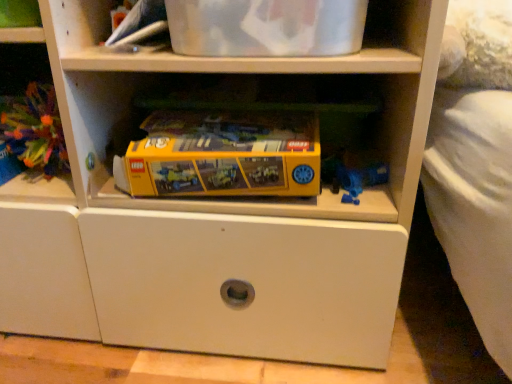
Where is `multicolored plastic toy at left, placed as the 1th toy when sorted from left to right`? The height and width of the screenshot is (384, 512). multicolored plastic toy at left, placed as the 1th toy when sorted from left to right is located at coordinates (35, 130).

What do you see at coordinates (35, 130) in the screenshot? I see `multicolored plastic toy at left, placed as the 1th toy when sorted from left to right` at bounding box center [35, 130].

In order to click on yellow plastic lego set at center, the 1th toy when ordered from right to left in this screenshot , I will do `click(222, 155)`.

Measure the distance between yellow plastic lego set at center, which appears as the 2th toy when viewed from the left, and camera.

yellow plastic lego set at center, which appears as the 2th toy when viewed from the left, and camera are 21.24 inches apart from each other.

What do you see at coordinates (222, 155) in the screenshot? The height and width of the screenshot is (384, 512). I see `yellow plastic lego set at center, which appears as the 2th toy when viewed from the left` at bounding box center [222, 155].

Identify the location of multicolored plastic toy at left, placed as the 1th toy when sorted from left to right. The height and width of the screenshot is (384, 512). (35, 130).

Is yellow plastic lego set at center, which appears as the 2th toy when viewed from the left, to the left of multicolored plastic toy at left, placed as the 1th toy when sorted from left to right, from the viewer's perspective?

No, yellow plastic lego set at center, which appears as the 2th toy when viewed from the left, is not to the left of multicolored plastic toy at left, placed as the 1th toy when sorted from left to right.

Does yellow plastic lego set at center, the 1th toy when ordered from right to left, come behind multicolored plastic toy at left, which is the second toy in right-to-left order?

That is False.

Is point (278, 176) positioned in front of point (69, 168)?

Yes, it is.

From the image's perspective, is yellow plastic lego set at center, the 1th toy when ordered from right to left, above multicolored plastic toy at left, placed as the 1th toy when sorted from left to right?

No.

From a real-world perspective, who is located lower, yellow plastic lego set at center, which appears as the 2th toy when viewed from the left, or multicolored plastic toy at left, placed as the 1th toy when sorted from left to right?

yellow plastic lego set at center, which appears as the 2th toy when viewed from the left, from a real-world perspective.

Does yellow plastic lego set at center, which appears as the 2th toy when viewed from the left, have a lesser width compared to multicolored plastic toy at left, placed as the 1th toy when sorted from left to right?

No.

Does yellow plastic lego set at center, which appears as the 2th toy when viewed from the left, have a lesser height compared to multicolored plastic toy at left, which is the second toy in right-to-left order?

Indeed, yellow plastic lego set at center, which appears as the 2th toy when viewed from the left, has a lesser height compared to multicolored plastic toy at left, which is the second toy in right-to-left order.

Considering the relative sizes of yellow plastic lego set at center, which appears as the 2th toy when viewed from the left, and multicolored plastic toy at left, placed as the 1th toy when sorted from left to right, in the image provided, is yellow plastic lego set at center, which appears as the 2th toy when viewed from the left, bigger than multicolored plastic toy at left, placed as the 1th toy when sorted from left to right,?

Yes.

Is yellow plastic lego set at center, which appears as the 2th toy when viewed from the left, positioned beyond the bounds of multicolored plastic toy at left, placed as the 1th toy when sorted from left to right?

Yes, yellow plastic lego set at center, which appears as the 2th toy when viewed from the left, is outside of multicolored plastic toy at left, placed as the 1th toy when sorted from left to right.

Is the surface of yellow plastic lego set at center, the 1th toy when ordered from right to left, in direct contact with multicolored plastic toy at left, which is the second toy in right-to-left order?

No, yellow plastic lego set at center, the 1th toy when ordered from right to left, is not touching multicolored plastic toy at left, which is the second toy in right-to-left order.

Is yellow plastic lego set at center, the 1th toy when ordered from right to left, positioned with its back to multicolored plastic toy at left, which is the second toy in right-to-left order?

No, yellow plastic lego set at center, the 1th toy when ordered from right to left, is not facing the opposite direction of multicolored plastic toy at left, which is the second toy in right-to-left order.

How many degrees apart are the facing directions of yellow plastic lego set at center, the 1th toy when ordered from right to left, and multicolored plastic toy at left, which is the second toy in right-to-left order?

They differ by 1.52 degrees in their facing directions.

The height and width of the screenshot is (384, 512). In order to click on toy above the yellow plastic lego set at center, which appears as the 2th toy when viewed from the left (from the image's perspective) in this screenshot , I will do `click(35, 130)`.

Is multicolored plastic toy at left, which is the second toy in right-to-left order, to the left of yellow plastic lego set at center, the 1th toy when ordered from right to left, from the viewer's perspective?

Indeed, multicolored plastic toy at left, which is the second toy in right-to-left order, is positioned on the left side of yellow plastic lego set at center, the 1th toy when ordered from right to left.

Which object is closer to the camera taking this photo, multicolored plastic toy at left, placed as the 1th toy when sorted from left to right, or yellow plastic lego set at center, the 1th toy when ordered from right to left?

yellow plastic lego set at center, the 1th toy when ordered from right to left, is in front.

Is point (42, 139) closer or farther from the camera than point (137, 144)?

Point (42, 139) appears to be farther away from the viewer than point (137, 144).

From the image's perspective, is multicolored plastic toy at left, placed as the 1th toy when sorted from left to right, on yellow plastic lego set at center, which appears as the 2th toy when viewed from the left?

Yes.

From a real-world perspective, is multicolored plastic toy at left, which is the second toy in right-to-left order, over yellow plastic lego set at center, which appears as the 2th toy when viewed from the left?

Yes.

Considering the relative sizes of multicolored plastic toy at left, placed as the 1th toy when sorted from left to right, and yellow plastic lego set at center, the 1th toy when ordered from right to left, in the image provided, is multicolored plastic toy at left, placed as the 1th toy when sorted from left to right, thinner than yellow plastic lego set at center, the 1th toy when ordered from right to left,?

Correct, the width of multicolored plastic toy at left, placed as the 1th toy when sorted from left to right, is less than that of yellow plastic lego set at center, the 1th toy when ordered from right to left.

Considering the relative sizes of multicolored plastic toy at left, placed as the 1th toy when sorted from left to right, and yellow plastic lego set at center, the 1th toy when ordered from right to left, in the image provided, is multicolored plastic toy at left, placed as the 1th toy when sorted from left to right, taller than yellow plastic lego set at center, the 1th toy when ordered from right to left,?

Yes.

Which of these two, multicolored plastic toy at left, which is the second toy in right-to-left order, or yellow plastic lego set at center, which appears as the 2th toy when viewed from the left, is smaller?

Smaller between the two is multicolored plastic toy at left, which is the second toy in right-to-left order.

Is multicolored plastic toy at left, placed as the 1th toy when sorted from left to right, located outside yellow plastic lego set at center, the 1th toy when ordered from right to left?

Indeed, multicolored plastic toy at left, placed as the 1th toy when sorted from left to right, is completely outside yellow plastic lego set at center, the 1th toy when ordered from right to left.

Is multicolored plastic toy at left, placed as the 1th toy when sorted from left to right, next to yellow plastic lego set at center, the 1th toy when ordered from right to left?

No, multicolored plastic toy at left, placed as the 1th toy when sorted from left to right, is not with yellow plastic lego set at center, the 1th toy when ordered from right to left.

Is multicolored plastic toy at left, placed as the 1th toy when sorted from left to right, oriented away from yellow plastic lego set at center, which appears as the 2th toy when viewed from the left?

That's not correct — multicolored plastic toy at left, placed as the 1th toy when sorted from left to right, is not looking away from yellow plastic lego set at center, which appears as the 2th toy when viewed from the left.

How different are the orientations of multicolored plastic toy at left, placed as the 1th toy when sorted from left to right, and yellow plastic lego set at center, the 1th toy when ordered from right to left, in degrees?

The angular difference between multicolored plastic toy at left, placed as the 1th toy when sorted from left to right, and yellow plastic lego set at center, the 1th toy when ordered from right to left, is 1.52 degrees.

Find the location of a particular element. The height and width of the screenshot is (384, 512). toy above the yellow plastic lego set at center, the 1th toy when ordered from right to left (from a real-world perspective) is located at coordinates (35, 130).

Identify the location of toy located on the right of multicolored plastic toy at left, placed as the 1th toy when sorted from left to right. This screenshot has height=384, width=512. (222, 155).

At what (x,y) coordinates should I click in order to perform the action: click on toy above the yellow plastic lego set at center, the 1th toy when ordered from right to left (from a real-world perspective). Please return your answer as a coordinate pair (x, y). Looking at the image, I should click on (35, 130).